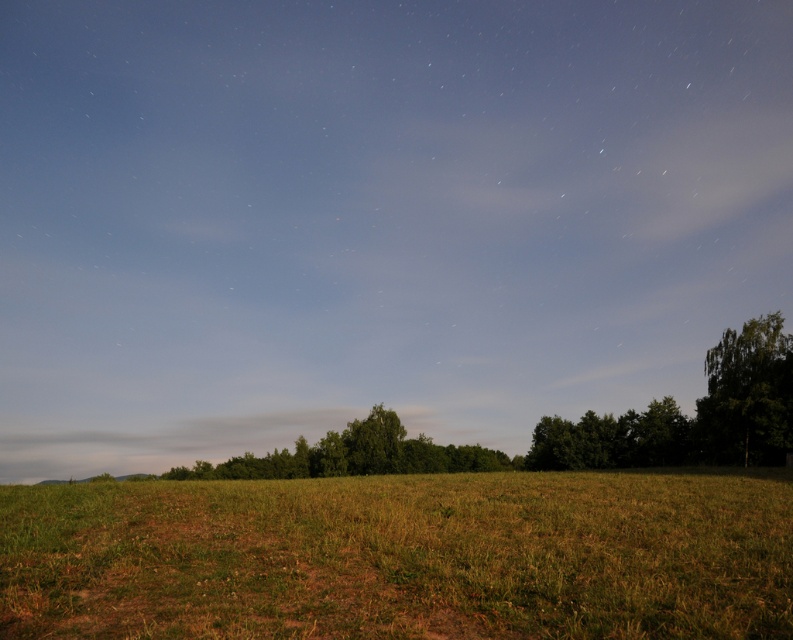
Can you confirm if green leafy tree at right is taller than green leafy tree at center?

In fact, green leafy tree at right may be shorter than green leafy tree at center.

The image size is (793, 640). What are the coordinates of `green leafy tree at right` in the screenshot? It's located at click(x=746, y=396).

Is green grassy field at lower center further to camera compared to green leafy tree at right?

That is False.

Is point (52, 566) positioned behind point (703, 444)?

No.

Where is `green grassy field at lower center`? Image resolution: width=793 pixels, height=640 pixels. green grassy field at lower center is located at coordinates coord(401,556).

Does green grassy field at lower center appear on the right side of green leafy tree at center?

Yes, green grassy field at lower center is to the right of green leafy tree at center.

Which is below, green grassy field at lower center or green leafy tree at center?

green leafy tree at center is below.

Locate an element on the screen. The height and width of the screenshot is (640, 793). green grassy field at lower center is located at coordinates (401, 556).